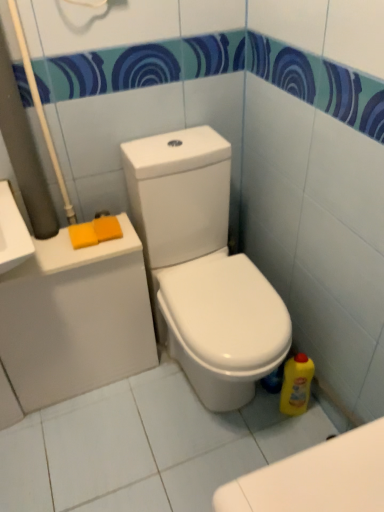
Question: In terms of width, does orange sponge at upper left, which is the second soap in left-to-right order, look wider or thinner when compared to yellow plastic bottle at lower right?

Choices:
 (A) thin
 (B) wide

Answer: (B)

Question: Is orange sponge at upper left, which is the 1th soap from right to left, inside the boundaries of yellow plastic bottle at lower right, or outside?

Choices:
 (A) inside
 (B) outside

Answer: (B)

Question: Which object is positioned farthest from the orange sponge at left, the first soap in the left-to-right sequence?

Choices:
 (A) white glossy toilet at center
 (B) orange sponge at upper left, which is the 1th soap from right to left
 (C) yellow plastic bottle at lower right

Answer: (C)

Question: Which of these objects is positioned farthest from the orange sponge at upper left, which is the second soap in left-to-right order?

Choices:
 (A) yellow plastic bottle at lower right
 (B) white glossy toilet at center
 (C) orange sponge at left, the 2th soap positioned from the right

Answer: (A)